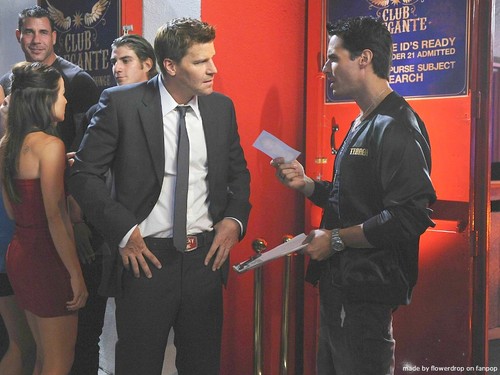
This screenshot has height=375, width=500. I want to click on hinges, so click(482, 104), click(479, 250).